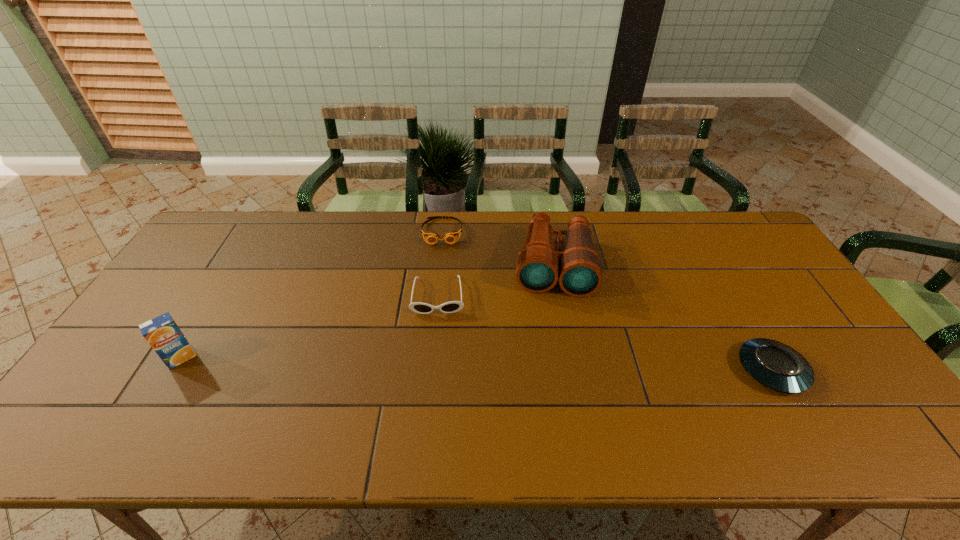
Locate an element on the screen. This screenshot has height=540, width=960. vacant point located with the lenses facing forward on the goggles is located at coordinates pos(441,270).

The width and height of the screenshot is (960, 540). Identify the location of vacant space located with the lenses facing forward on the goggles. (441, 270).

What are the coordinates of `free space located 0.250m with the lenses facing forward on the goggles` in the screenshot? It's located at (440, 299).

The height and width of the screenshot is (540, 960). Identify the location of free space located with the lenses of the sunglasses facing outward. (437, 347).

Where is `vacant region located with the lenses of the sunglasses facing outward`? This screenshot has height=540, width=960. vacant region located with the lenses of the sunglasses facing outward is located at coordinates (436, 382).

What are the coordinates of `vacant region located with the lenses of the sunglasses facing outward` in the screenshot? It's located at (437, 349).

At what (x,y) coordinates should I click in order to perform the action: click on binoculars at the far edge. Please return your answer as a coordinate pair (x, y). This screenshot has height=540, width=960. Looking at the image, I should click on (579, 268).

This screenshot has height=540, width=960. Find the location of `goggles located at the far edge`. goggles located at the far edge is located at coordinates (450, 237).

The width and height of the screenshot is (960, 540). Find the location of `object at the near edge`. object at the near edge is located at coordinates (775, 365).

At what (x,y) coordinates should I click in order to perform the action: click on object present at the left edge. Please return your answer as a coordinate pair (x, y). This screenshot has height=540, width=960. Looking at the image, I should click on (162, 333).